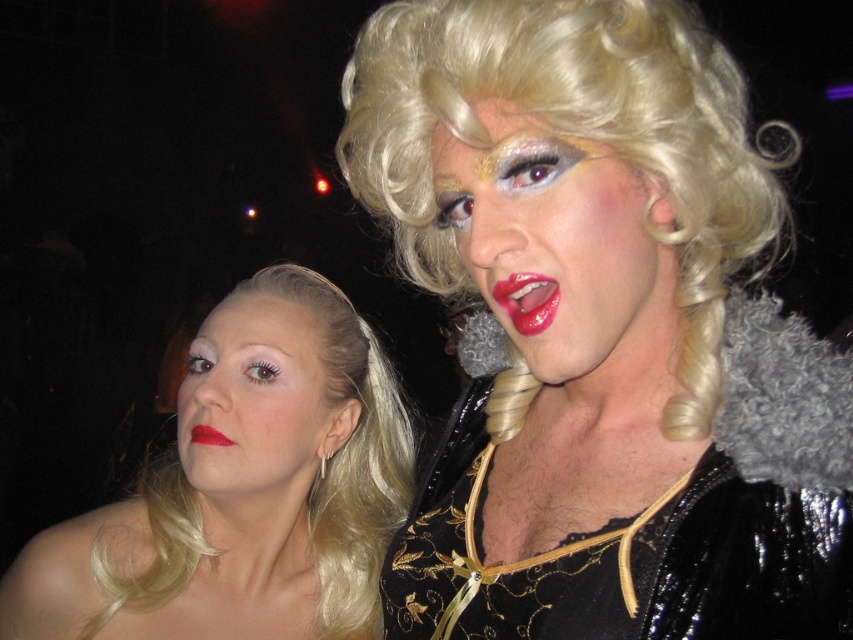
Question: Is the position of shiny gold wig at center more distant than that of matte skin face at lower left?

Choices:
 (A) yes
 (B) no

Answer: (B)

Question: Which object appears closest to the camera in this image?

Choices:
 (A) shiny gold wig at center
 (B) glossy red lips at center

Answer: (A)

Question: Does shiny gold wig at center have a smaller size compared to matte skin face at lower left?

Choices:
 (A) yes
 (B) no

Answer: (A)

Question: Which object is positioned closest to the matte red lipstick at lower left?

Choices:
 (A) shiny blonde hair at center
 (B) shiny gold wig at center
 (C) matte skin face at lower left
 (D) glossy red lips at center

Answer: (C)

Question: Among these points, which one is farthest from the camera?

Choices:
 (A) (607, 518)
 (B) (541, 285)

Answer: (A)

Question: Can you confirm if shiny black wig at upper right is positioned below shiny gold wig at center?

Choices:
 (A) yes
 (B) no

Answer: (B)